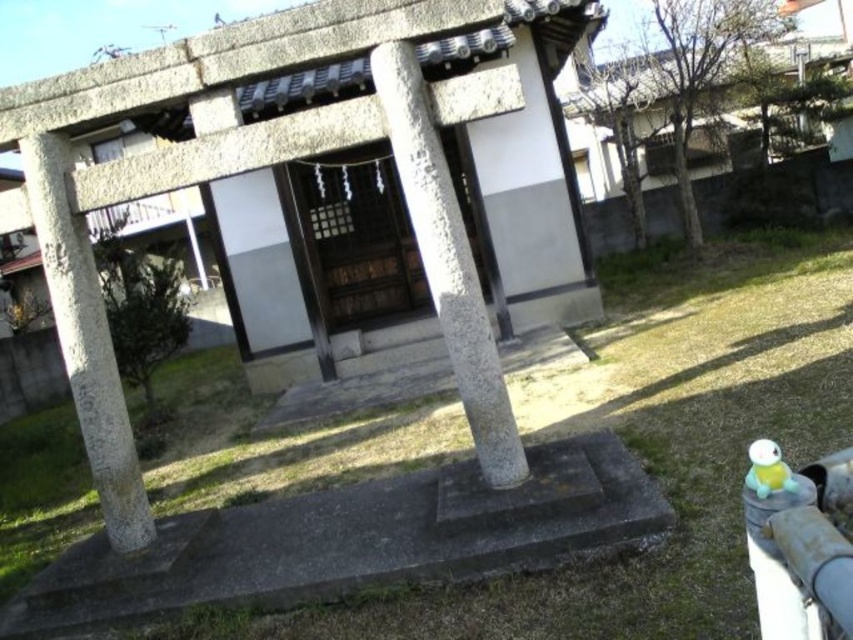
From the picture: Who is lower down, gray stone pillar at center or gray concrete pillar at left?

Positioned lower is gray concrete pillar at left.

Who is more forward, (413, 220) or (83, 404)?

Point (413, 220) is more forward.

Is point (422, 168) positioned before point (67, 214)?

That is True.

Find the location of a particular element. Image resolution: width=853 pixels, height=640 pixels. gray stone pillar at center is located at coordinates (447, 262).

Does green grass at lower left lie behind wooden door at center?

No, it is in front of wooden door at center.

From the picture: Who is more forward, (167, 499) or (461, 182)?

Positioned in front is point (167, 499).

Who is more distant from viewer, (762, 234) or (409, 260)?

Point (762, 234)

The image size is (853, 640). Identify the location of green grass at lower left. (648, 448).

Is green grass at lower left bigger than gray concrete pillar at left?

Yes.

Does point (625, 564) come farther from viewer compared to point (109, 342)?

No.

Locate an element on the screen. The image size is (853, 640). green grass at lower left is located at coordinates (648, 448).